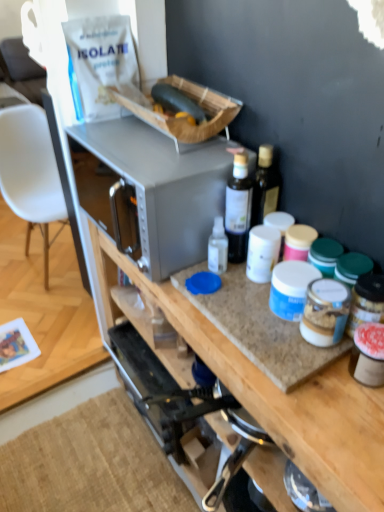
Identify the location of vacant point above satin silver microwave at center (from a real-world perspective). (140, 144).